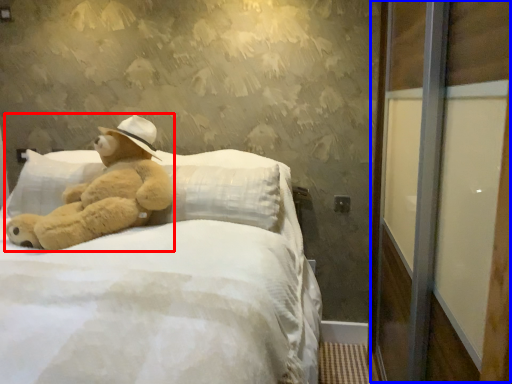
Question: Which object is closer to the camera taking this photo, teddy bear (highlighted by a red box) or screen door (highlighted by a blue box)?

Choices:
 (A) teddy bear
 (B) screen door

Answer: (B)